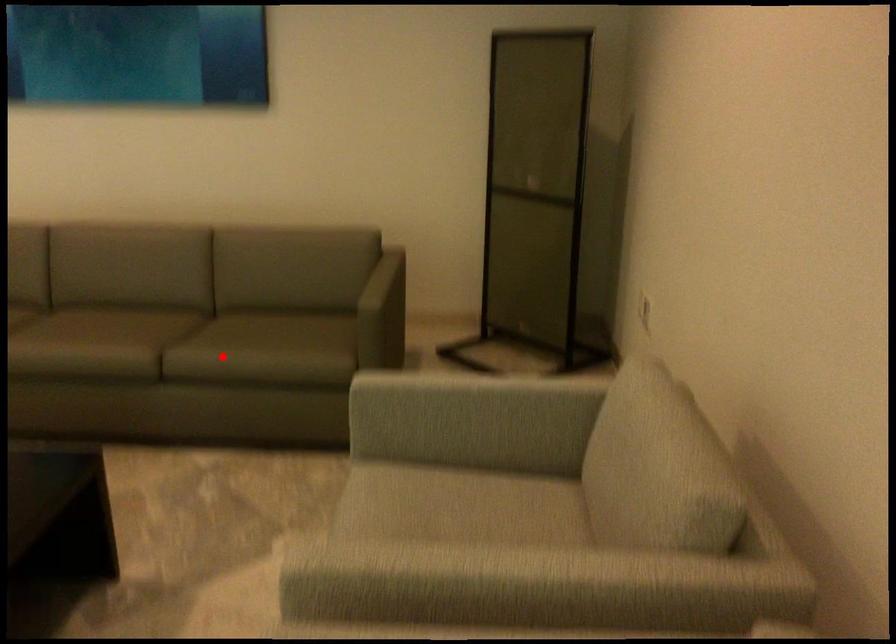
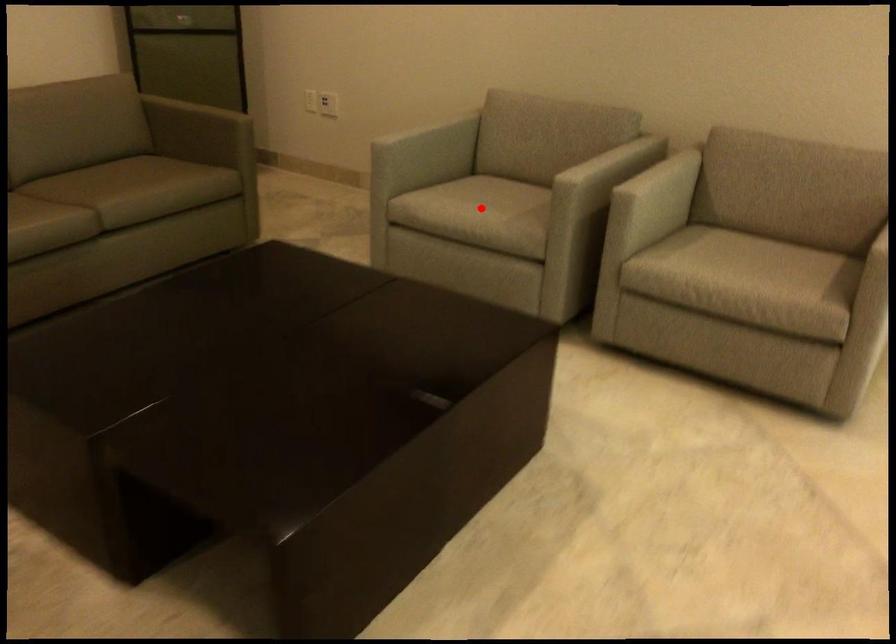
I am providing you with two images of the same scene from different viewpoints. A red point is marked on the first image and another point is marked on the second image. Are the points marked in image1 and image2 representing the same 3D position?

No